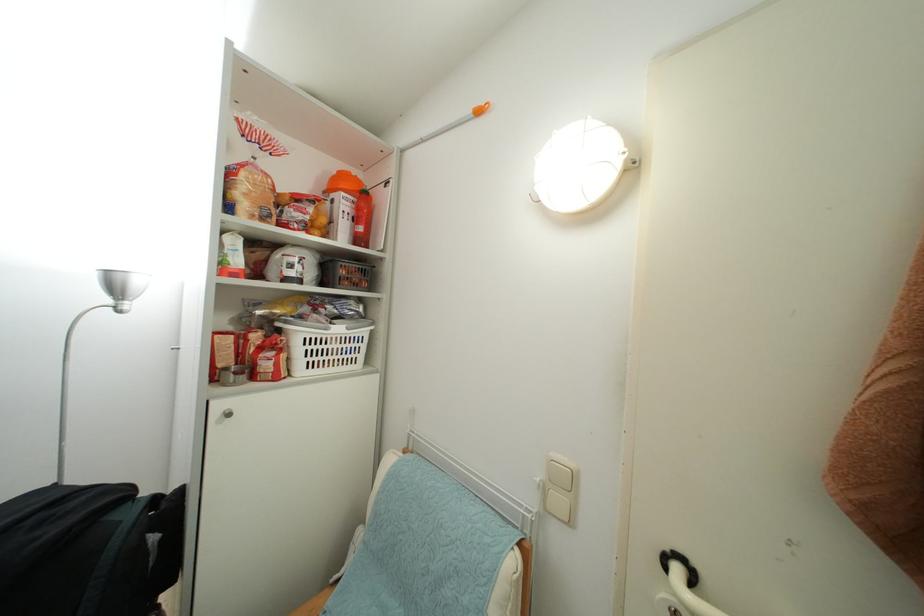
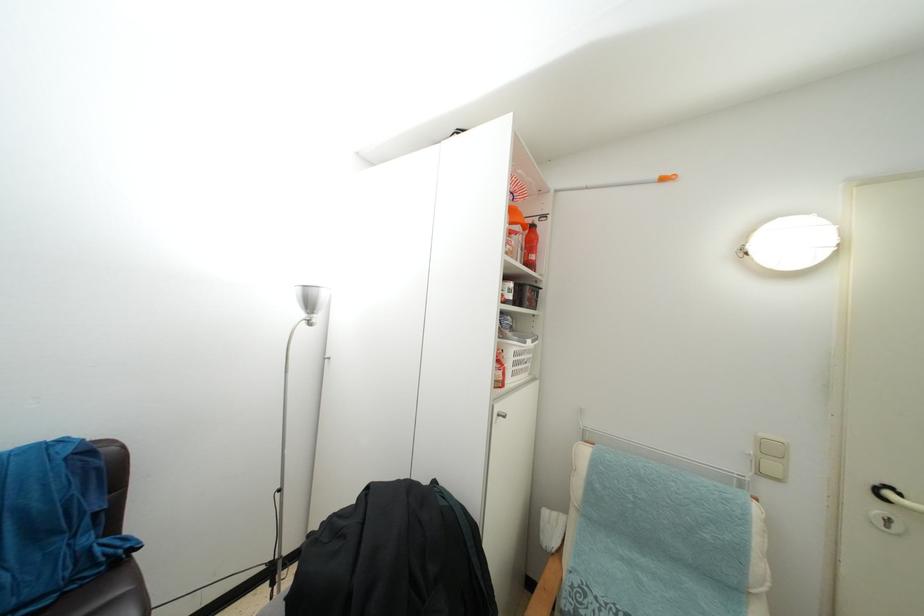
Question: In a continuous first-person perspective shot, in which direction is the camera moving?

Choices:
 (A) Left
 (B) Right
 (C) Forward
 (D) Backward

Answer: (A)